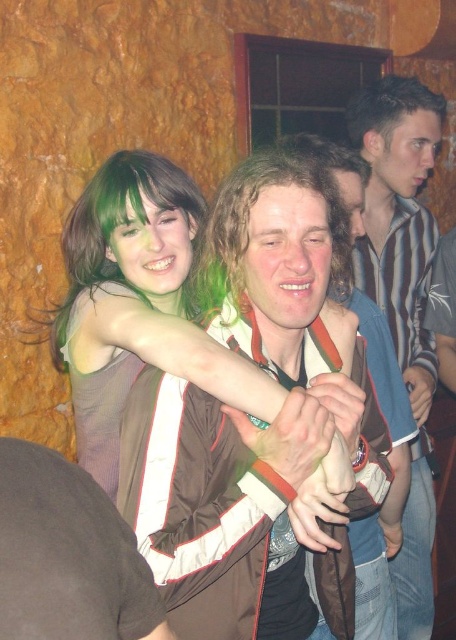
Question: Which point appears farthest from the camera in this image?

Choices:
 (A) (429, 106)
 (B) (150, 200)
 (C) (279, 278)
 (D) (228, 364)

Answer: (A)

Question: Is matte green hair at center positioned before smooth skin face at upper right?

Choices:
 (A) yes
 (B) no

Answer: (A)

Question: Which object is positioned farthest from the striped cotton shirt at upper right?

Choices:
 (A) smooth skin face at upper right
 (B) matte brown hair at center

Answer: (B)

Question: Can you confirm if matte green hair at center is wider than green hair at upper left?

Choices:
 (A) yes
 (B) no

Answer: (A)

Question: Does striped cotton shirt at upper right have a lesser width compared to matte brown hair at center?

Choices:
 (A) no
 (B) yes

Answer: (A)

Question: Which of the following is the closest to the observer?

Choices:
 (A) (410, 579)
 (B) (347, 195)
 (C) (387, 140)
 (D) (296, 314)

Answer: (D)